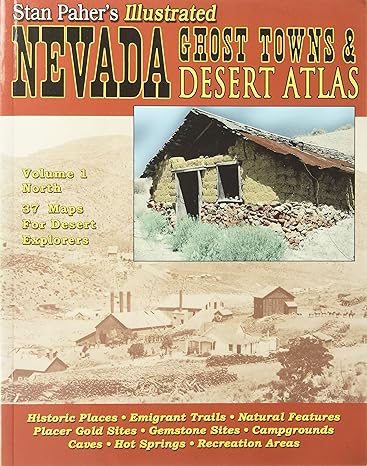
What are the coordinates of `book` in the screenshot? It's located at (125, 285).